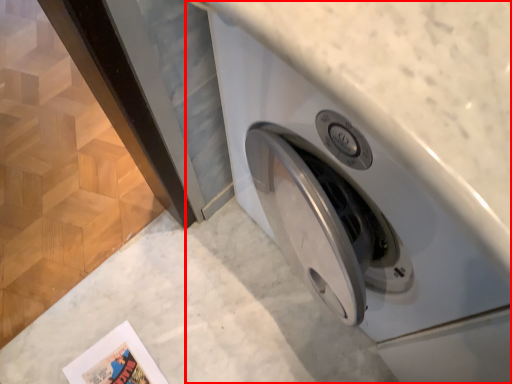
Question: From the image's perspective, where is washing machine (annotated by the red box) located relative to comic book?

Choices:
 (A) above
 (B) below

Answer: (A)